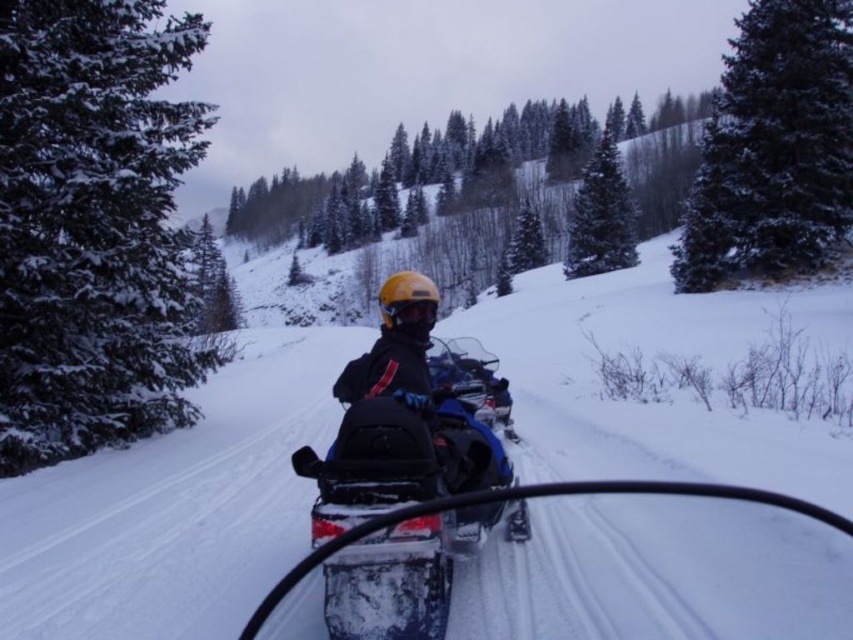
Question: Can you confirm if snowy evergreen tree at upper right is positioned above green matte pine at upper center?

Choices:
 (A) no
 (B) yes

Answer: (A)

Question: Is blue matte snowmobile at center wider than green matte pine at upper center?

Choices:
 (A) yes
 (B) no

Answer: (B)

Question: Considering the real-world distances, which object is closest to the green matte pine at upper center?

Choices:
 (A) blue matte snowmobile at center
 (B) snowy evergreen tree at upper right

Answer: (B)

Question: Which object is positioned closest to the blue matte snowmobile at center?

Choices:
 (A) green matte pine at upper center
 (B) snowy evergreen tree at upper right

Answer: (B)

Question: Is the position of blue matte snowmobile at center less distant than that of green matte pine at upper center?

Choices:
 (A) no
 (B) yes

Answer: (B)

Question: Which point is closer to the camera?

Choices:
 (A) (399, 632)
 (B) (778, 266)
 (C) (599, 237)

Answer: (A)